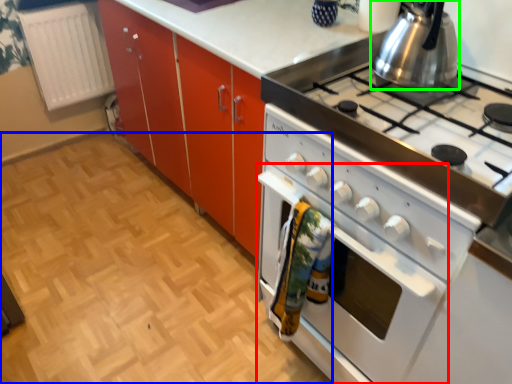
Question: Which object is positioned farthest from oven (highlighted by a red box)? Select from plain (highlighted by a blue box) and kitchen appliance (highlighted by a green box).

Choices:
 (A) plain
 (B) kitchen appliance

Answer: (A)